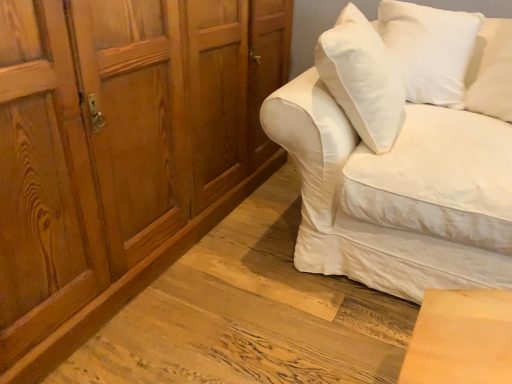
Question: Is wooden cabinet at left looking in the opposite direction of white soft cushion at upper right?

Choices:
 (A) no
 (B) yes

Answer: (A)

Question: Could you tell me if wooden cabinet at left is facing white soft cushion at upper right?

Choices:
 (A) no
 (B) yes

Answer: (B)

Question: Can you confirm if wooden cabinet at left is positioned to the left of white soft cushion at upper right?

Choices:
 (A) no
 (B) yes

Answer: (B)

Question: From the image's perspective, is wooden cabinet at left located above white soft cushion at upper right?

Choices:
 (A) yes
 (B) no

Answer: (B)

Question: Considering the relative sizes of wooden cabinet at left and white soft cushion at upper right in the image provided, is wooden cabinet at left smaller than white soft cushion at upper right?

Choices:
 (A) no
 (B) yes

Answer: (A)

Question: In terms of height, does white cotton couch at right look taller or shorter compared to wooden cabinet at left?

Choices:
 (A) tall
 (B) short

Answer: (B)

Question: In the image, is white cotton couch at right positioned in front of or behind wooden cabinet at left?

Choices:
 (A) front
 (B) behind

Answer: (B)

Question: Looking at the image, does white cotton couch at right seem bigger or smaller compared to wooden cabinet at left?

Choices:
 (A) big
 (B) small

Answer: (B)

Question: From the image's perspective, is white cotton couch at right located above or below wooden cabinet at left?

Choices:
 (A) below
 (B) above

Answer: (A)

Question: Considering the positions of white soft cushion at upper right and white cotton couch at right in the image, is white soft cushion at upper right bigger or smaller than white cotton couch at right?

Choices:
 (A) big
 (B) small

Answer: (B)

Question: In the image, is white soft cushion at upper right on the left side or the right side of white cotton couch at right?

Choices:
 (A) right
 (B) left

Answer: (A)

Question: From the image's perspective, is white soft cushion at upper right located above or below white cotton couch at right?

Choices:
 (A) above
 (B) below

Answer: (A)

Question: Would you say white soft cushion at upper right is inside or outside white cotton couch at right?

Choices:
 (A) inside
 (B) outside

Answer: (A)

Question: Relative to white cotton couch at right, is wooden cabinet at left in front or behind?

Choices:
 (A) behind
 (B) front

Answer: (B)

Question: Which is correct: wooden cabinet at left is inside white cotton couch at right, or outside of it?

Choices:
 (A) inside
 (B) outside

Answer: (B)